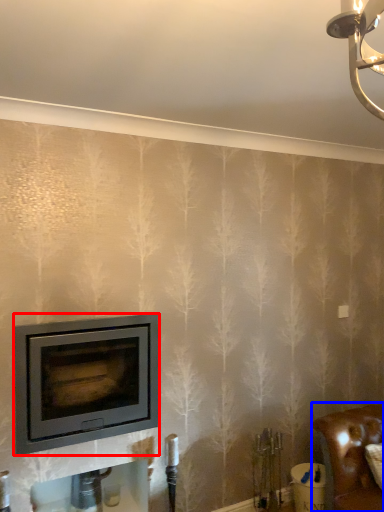
Question: Which object appears closest to the camera in this image, wood burning stove (highlighted by a red box) or furniture (highlighted by a blue box)?

Choices:
 (A) wood burning stove
 (B) furniture

Answer: (A)